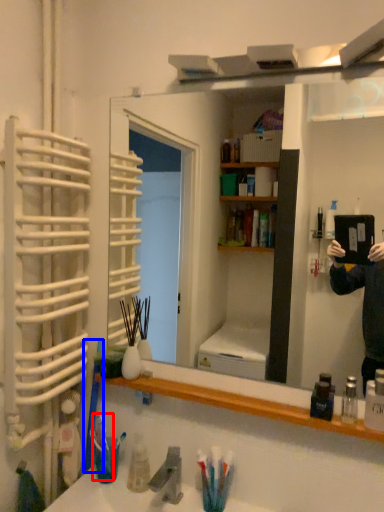
Question: Which object appears closest to the camera in this image, toothbrush (highlighted by a red box) or toothbrush (highlighted by a blue box)?

Choices:
 (A) toothbrush
 (B) toothbrush

Answer: (A)